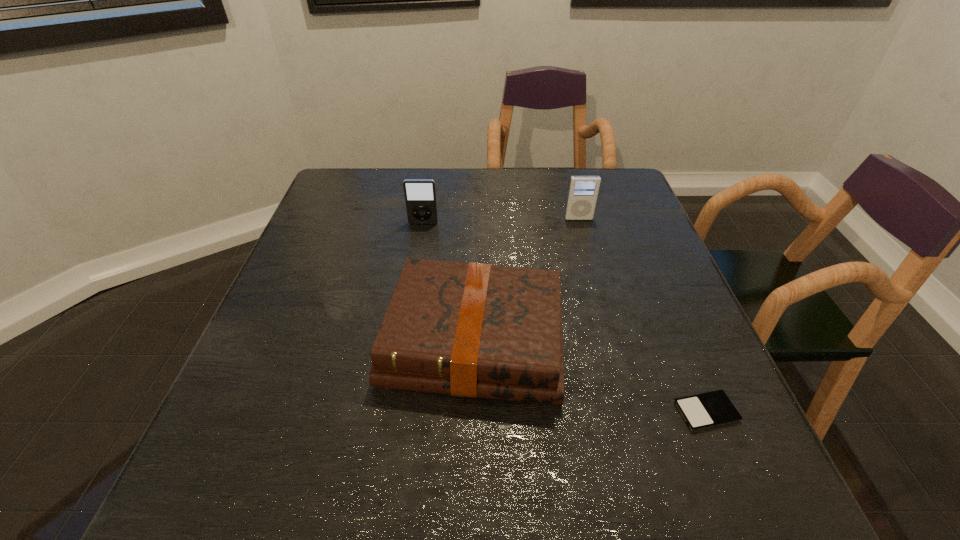
The image size is (960, 540). What are the coordinates of `free spot between the second nearest iPod and the farthest object` in the screenshot? It's located at (501, 221).

Locate an element on the screen. object that stands as the second closest to the third object from left to right is located at coordinates (420, 194).

I want to click on the third closest object relative to the rightmost iPod, so click(x=420, y=194).

This screenshot has height=540, width=960. In order to click on iPod object that ranks as the closest to the shortest iPod in this screenshot , I will do `click(583, 190)`.

Locate an element on the screen. the closest iPod relative to the second farthest object is located at coordinates (583, 190).

Identify the location of blank space that satisfies the following two spatial constraints: 1. on the front-facing side of the rightmost object; 2. on the right side of the second object from right to left. (633, 411).

This screenshot has height=540, width=960. I want to click on vacant space that satisfies the following two spatial constraints: 1. on the front-facing side of the shortest iPod; 2. on the left side of the second iPod from right to left, so click(633, 411).

Image resolution: width=960 pixels, height=540 pixels. Find the location of `free location that satisfies the following two spatial constraints: 1. on the front-facing side of the shortest iPod; 2. on the left side of the leftmost iPod`. free location that satisfies the following two spatial constraints: 1. on the front-facing side of the shortest iPod; 2. on the left side of the leftmost iPod is located at coordinates (394, 411).

Locate an element on the screen. vacant space that satisfies the following two spatial constraints: 1. on the front-facing side of the nearest iPod; 2. on the right side of the leftmost iPod is located at coordinates (394, 411).

Find the location of a particular element. vacant space that satisfies the following two spatial constraints: 1. on the front-facing side of the second nearest iPod; 2. on the left side of the hardback book is located at coordinates (405, 340).